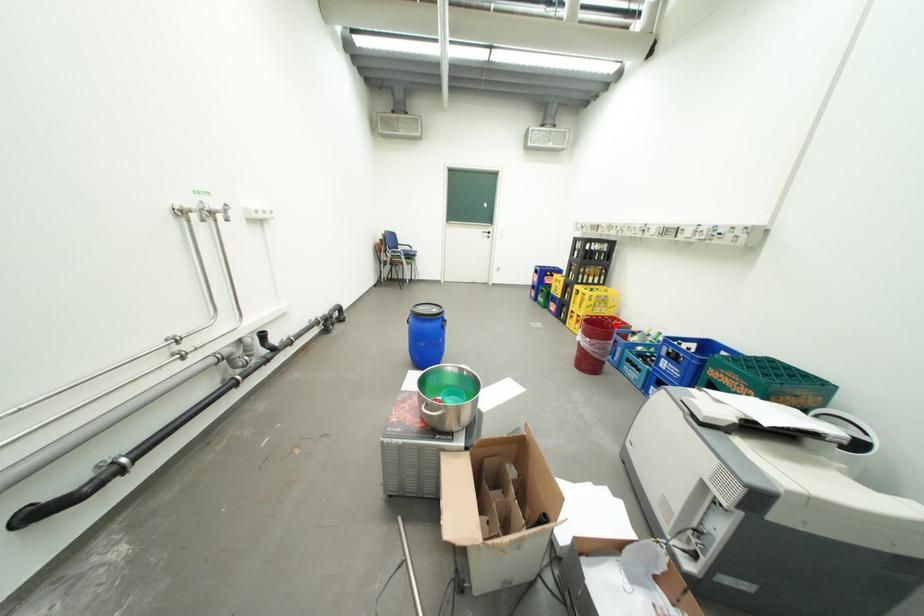
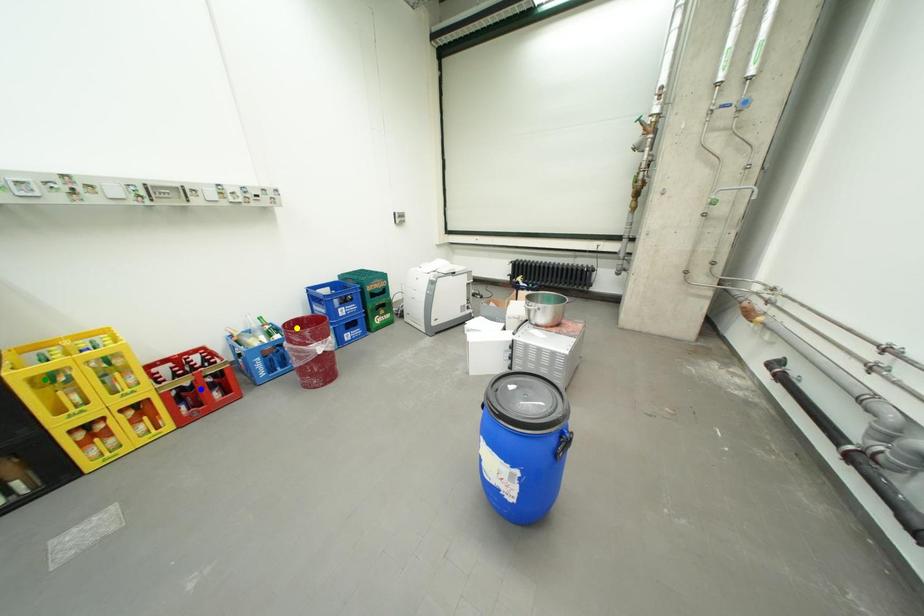
Question: I am providing you with two images of the same scene from different viewpoints. A red point is marked on the first image. You are given multiple points on the second image. Which point in image 2 represents the same 3d spot as the red point in image 1?

Choices:
 (A) yellow point
 (B) green point
 (C) blue point

Answer: (A)